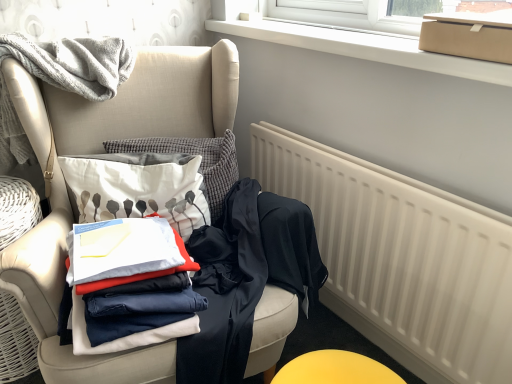
Question: Is matte beige armchair at left taller than white matte radiator at lower right?

Choices:
 (A) no
 (B) yes

Answer: (B)

Question: From the image's perspective, is matte beige armchair at left under white matte radiator at lower right?

Choices:
 (A) no
 (B) yes

Answer: (A)

Question: From the image's perspective, is matte beige armchair at left on white matte radiator at lower right?

Choices:
 (A) yes
 (B) no

Answer: (A)

Question: Considering the relative sizes of matte beige armchair at left and white matte radiator at lower right in the image provided, is matte beige armchair at left smaller than white matte radiator at lower right?

Choices:
 (A) no
 (B) yes

Answer: (A)

Question: From a real-world perspective, is matte beige armchair at left below white matte radiator at lower right?

Choices:
 (A) yes
 (B) no

Answer: (B)

Question: Can you confirm if matte beige armchair at left is shorter than white matte radiator at lower right?

Choices:
 (A) no
 (B) yes

Answer: (A)

Question: Is matte cardboard box at upper right next to white cotton pillow at center?

Choices:
 (A) yes
 (B) no

Answer: (B)

Question: Is matte cardboard box at upper right taller than white cotton pillow at center?

Choices:
 (A) no
 (B) yes

Answer: (A)

Question: Can we say matte cardboard box at upper right lies outside white cotton pillow at center?

Choices:
 (A) yes
 (B) no

Answer: (A)

Question: Is matte cardboard box at upper right positioned behind white cotton pillow at center?

Choices:
 (A) no
 (B) yes

Answer: (A)

Question: Considering the relative sizes of matte cardboard box at upper right and white cotton pillow at center in the image provided, is matte cardboard box at upper right wider than white cotton pillow at center?

Choices:
 (A) no
 (B) yes

Answer: (A)

Question: Is white cotton pillow at center inside matte cardboard box at upper right?

Choices:
 (A) yes
 (B) no

Answer: (B)

Question: Considering the relative sizes of matte beige armchair at left and dark blue fabric pants at center, placed as the 2th clothing when sorted from right to left, in the image provided, is matte beige armchair at left bigger than dark blue fabric pants at center, placed as the 2th clothing when sorted from right to left,?

Choices:
 (A) yes
 (B) no

Answer: (A)